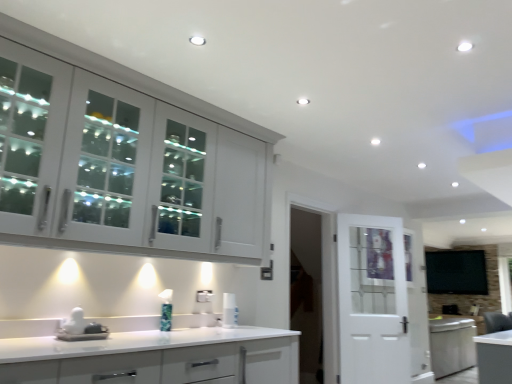
Question: From the image's perspective, would you say white glossy countertop at lower center, the first cabinetry from the bottom, is positioned over white glossy cabinet at upper left, the 2th cabinetry positioned from the bottom?

Choices:
 (A) yes
 (B) no

Answer: (B)

Question: Could you tell me if white glossy countertop at lower center, the first cabinetry from the bottom, is turned towards white glossy cabinet at upper left, the 2th cabinetry positioned from the bottom?

Choices:
 (A) no
 (B) yes

Answer: (A)

Question: Is the position of white glossy countertop at lower center, the first cabinetry from the bottom, less distant than that of white glossy cabinet at upper left, the 2th cabinetry positioned from the bottom?

Choices:
 (A) no
 (B) yes

Answer: (B)

Question: Considering the relative sizes of white glossy countertop at lower center, the first cabinetry from the bottom, and white glossy cabinet at upper left, the 2th cabinetry positioned from the bottom, in the image provided, is white glossy countertop at lower center, the first cabinetry from the bottom, bigger than white glossy cabinet at upper left, the 2th cabinetry positioned from the bottom,?

Choices:
 (A) no
 (B) yes

Answer: (A)

Question: Is white glossy countertop at lower center, the first cabinetry from the bottom, to the right of white glossy cabinet at upper left, the 2th cabinetry positioned from the bottom, from the viewer's perspective?

Choices:
 (A) yes
 (B) no

Answer: (A)

Question: From the image's perspective, is white glossy cabinet at upper left, the first cabinetry from the top, positioned above or below white glossy sink at lower left?

Choices:
 (A) below
 (B) above

Answer: (B)

Question: Is white glossy cabinet at upper left, the 2th cabinetry positioned from the bottom, to the left or to the right of white glossy sink at lower left in the image?

Choices:
 (A) left
 (B) right

Answer: (B)

Question: From a real-world perspective, is white glossy cabinet at upper left, the 2th cabinetry positioned from the bottom, physically located above or below white glossy sink at lower left?

Choices:
 (A) above
 (B) below

Answer: (A)

Question: Looking at the image, does white glossy cabinet at upper left, the first cabinetry from the top, seem bigger or smaller compared to white glossy sink at lower left?

Choices:
 (A) big
 (B) small

Answer: (A)

Question: Is white glossy countertop at lower center, the first cabinetry from the bottom, bigger or smaller than white glossy cabinet at upper left, the 2th cabinetry positioned from the bottom?

Choices:
 (A) small
 (B) big

Answer: (A)

Question: Relative to white glossy cabinet at upper left, the first cabinetry from the top, is white glossy countertop at lower center, the first cabinetry from the bottom, in front or behind?

Choices:
 (A) behind
 (B) front

Answer: (B)

Question: Is white glossy countertop at lower center, which is the 2th cabinetry in top-to-bottom order, taller or shorter than white glossy cabinet at upper left, the first cabinetry from the top?

Choices:
 (A) tall
 (B) short

Answer: (B)

Question: Would you say white glossy countertop at lower center, the first cabinetry from the bottom, is to the left or to the right of white glossy cabinet at upper left, the 2th cabinetry positioned from the bottom, in the picture?

Choices:
 (A) left
 (B) right

Answer: (B)

Question: Is white glossy spray can at center bigger or smaller than white glossy countertop at lower center, the first cabinetry from the bottom?

Choices:
 (A) small
 (B) big

Answer: (A)

Question: Is white glossy spray can at center in front of or behind white glossy countertop at lower center, which is the 2th cabinetry in top-to-bottom order, in the image?

Choices:
 (A) behind
 (B) front

Answer: (A)